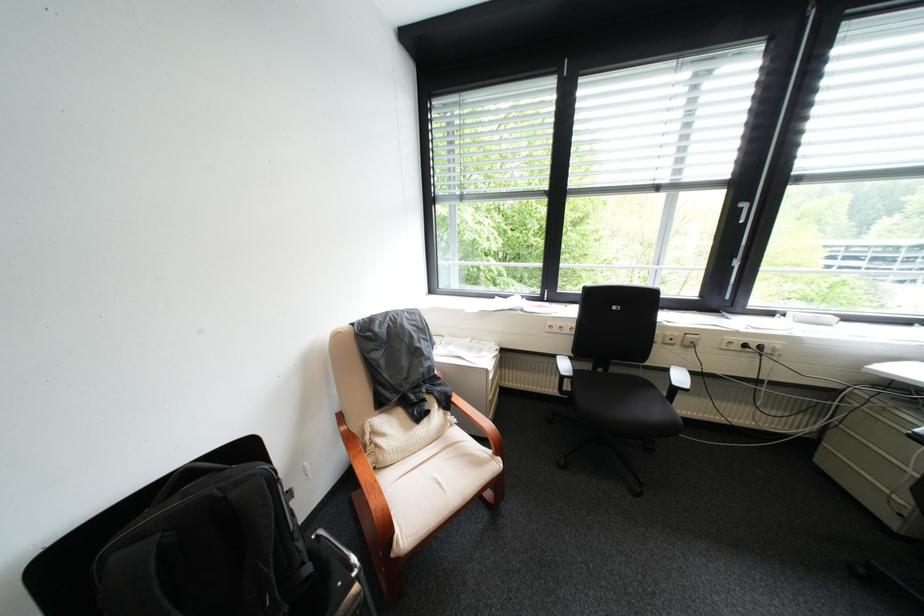
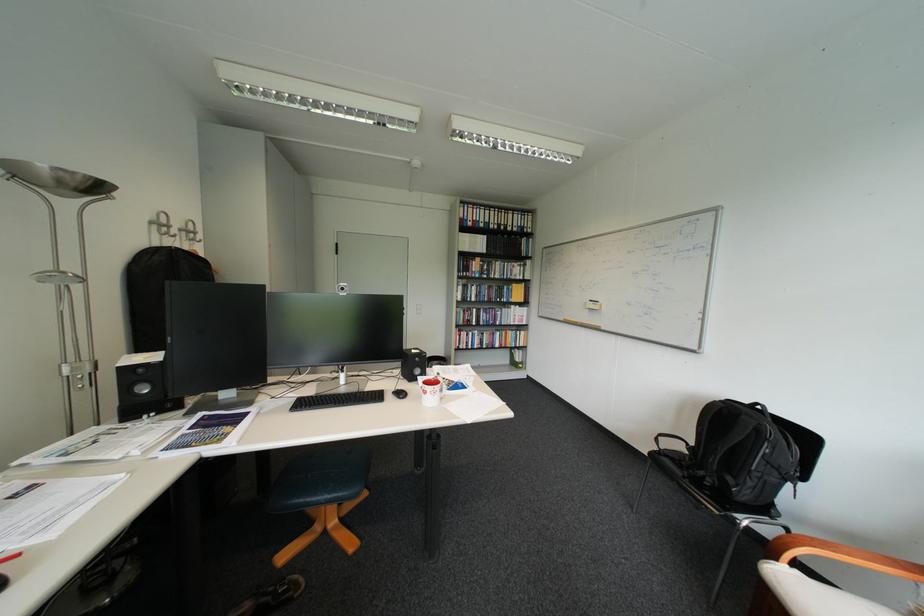
Where in the second image is the point corresponding to pixel 406 533 from the first image?

(788, 560)